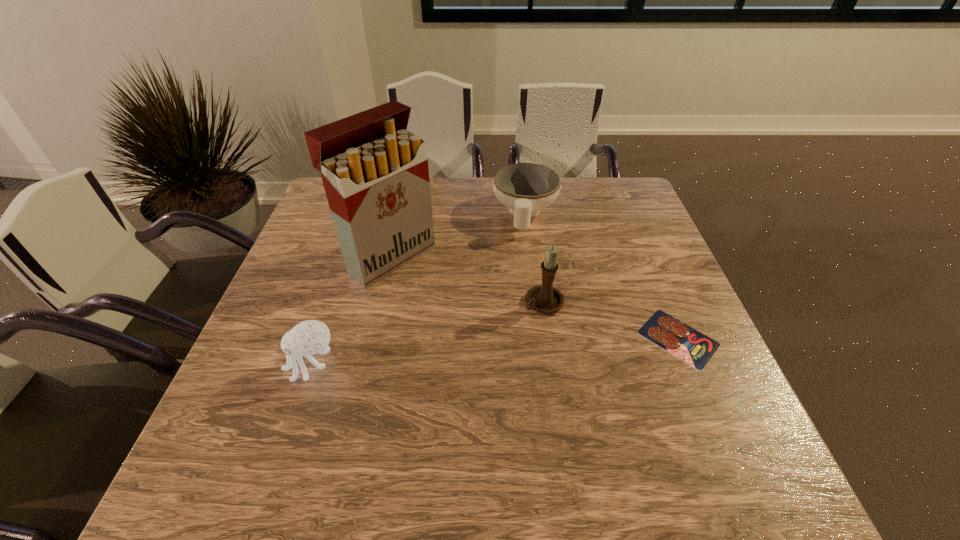
Image resolution: width=960 pixels, height=540 pixels. I want to click on cigarette case that is at the left edge, so click(x=375, y=173).

The width and height of the screenshot is (960, 540). Identify the location of object that is positioned at the right edge. (691, 346).

At what (x,y) coordinates should I click in order to perform the action: click on vacant space at the near edge. Please return your answer as a coordinate pair (x, y). The width and height of the screenshot is (960, 540). Looking at the image, I should click on (516, 408).

This screenshot has width=960, height=540. What are the coordinates of `free region at the left edge of the desktop` in the screenshot? It's located at (336, 250).

In the image, there is a desktop. Identify the location of vacant space at the right edge. (625, 235).

Locate an element on the screen. This screenshot has height=540, width=960. blank area at the far right corner is located at coordinates (640, 201).

Identify the location of vacant area that lies between the shortest object and the candle holder. The height and width of the screenshot is (540, 960). (611, 321).

This screenshot has height=540, width=960. I want to click on free space between the chinaware and the tallest object, so click(x=458, y=235).

The height and width of the screenshot is (540, 960). What are the coordinates of `free area in between the second shortest object and the tallest object` in the screenshot? It's located at (458, 235).

Locate an element on the screen. Image resolution: width=960 pixels, height=540 pixels. free space between the fourth tallest object and the octopus is located at coordinates (419, 289).